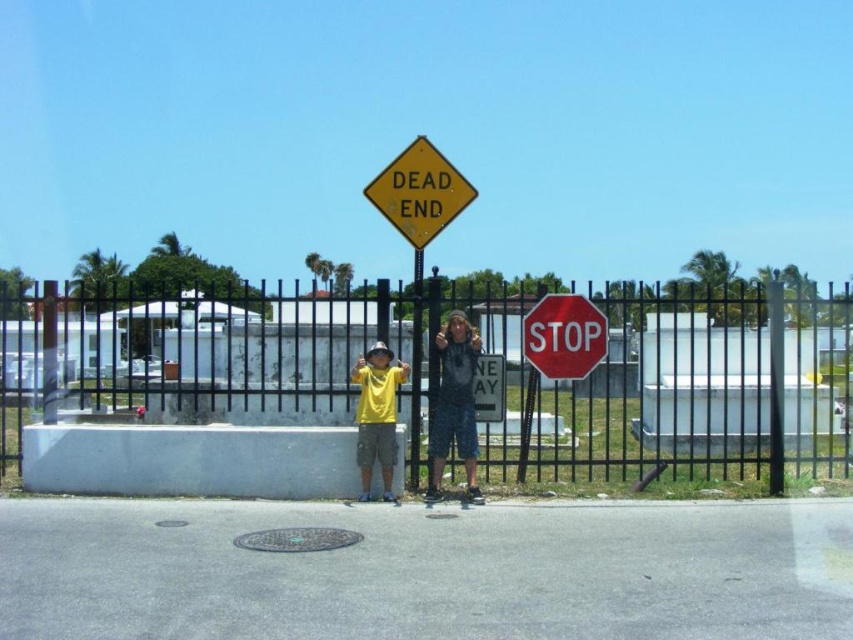
Question: Is black metal fence at center thinner than red matte stop sign at center?

Choices:
 (A) yes
 (B) no

Answer: (B)

Question: Which is nearer to the yellow diamond-shaped sign at center?

Choices:
 (A) black metal fence at center
 (B) denim shorts at center
 (C) yellow matte shirt at center
 (D) red matte stop sign at center

Answer: (D)

Question: Is denim shorts at center thinner than red matte stop sign at center?

Choices:
 (A) yes
 (B) no

Answer: (A)

Question: Observing the image, what is the correct spatial positioning of black metal fence at center in reference to yellow diamond-shaped sign at center?

Choices:
 (A) below
 (B) above

Answer: (A)

Question: Which of the following is the farthest from the observer?

Choices:
 (A) black metal fence at center
 (B) denim shorts at center
 (C) yellow matte shirt at center
 (D) yellow diamond-shaped sign at center

Answer: (D)

Question: Which of the following is the closest to the observer?

Choices:
 (A) (422, 214)
 (B) (567, 372)
 (C) (379, 365)

Answer: (C)